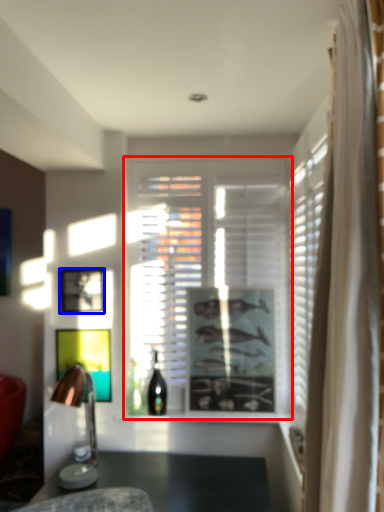
Question: Among these objects, which one is nearest to the camera, window (highlighted by a red box) or picture frame (highlighted by a blue box)?

Choices:
 (A) window
 (B) picture frame

Answer: (B)